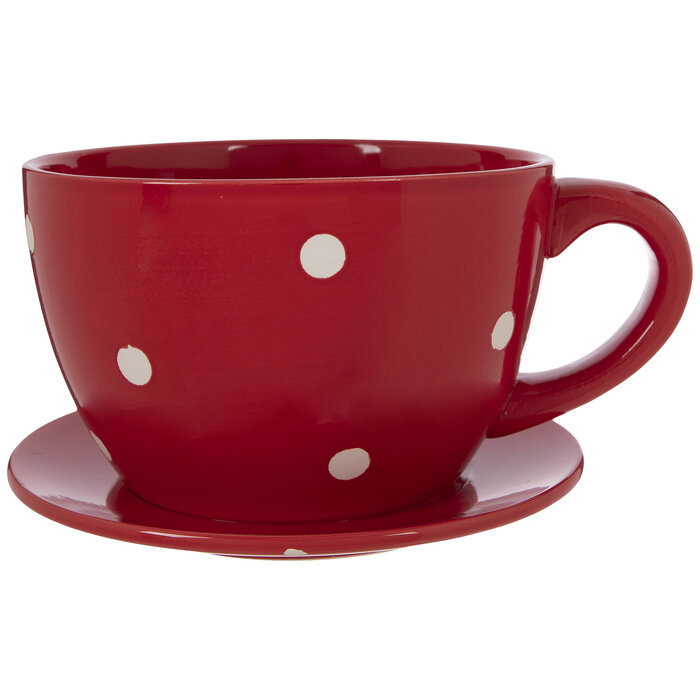
Identify the location of teacup. This screenshot has height=700, width=700. (360, 416).